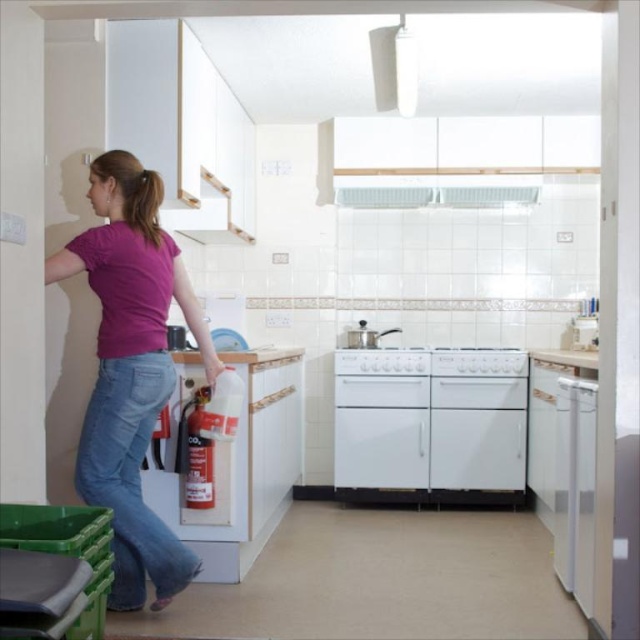
Question: Can you confirm if jeans at lower left is positioned below white glossy stove at center?

Choices:
 (A) no
 (B) yes

Answer: (A)

Question: Which point appears closest to the camera in this image?

Choices:
 (A) (360, 332)
 (B) (104, 440)

Answer: (B)

Question: Is jeans at lower left thinner than white glossy oven at center?

Choices:
 (A) no
 (B) yes

Answer: (B)

Question: Observing the image, what is the correct spatial positioning of pink matte shirt at left in reference to white glossy dishwasher at right?

Choices:
 (A) above
 (B) below

Answer: (A)

Question: Which object is closer to the camera taking this photo?

Choices:
 (A) white glossy stove at center
 (B) white glossy dishwasher at right
 (C) pink matte shirt at left
 (D) jeans at lower left

Answer: (C)

Question: Which is farther from the white glossy stove at center?

Choices:
 (A) pink matte shirt at left
 (B) jeans at lower left
 (C) white glossy dishwasher at right
 (D) white glossy oven at center

Answer: (B)